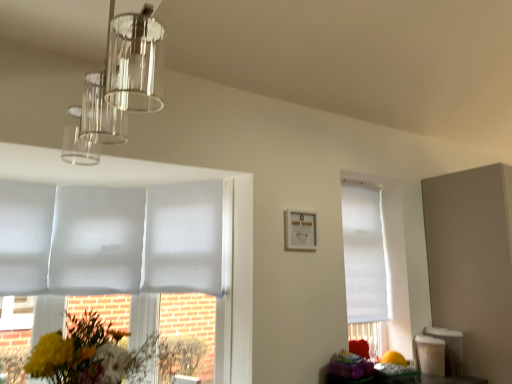
The width and height of the screenshot is (512, 384). What do you see at coordinates (25, 236) in the screenshot? I see `white matte blind at left, positioned as the 4th blind in right-to-left order` at bounding box center [25, 236].

Where is `matte white picture frame at center`? matte white picture frame at center is located at coordinates (300, 230).

Where is `white matte blind at center, which is the 3th blind in left-to-right order`? Image resolution: width=512 pixels, height=384 pixels. white matte blind at center, which is the 3th blind in left-to-right order is located at coordinates (184, 238).

Is point (155, 69) closer or farther from the camera than point (106, 214)?

Point (155, 69) appears to be closer to the viewer than point (106, 214).

Does clear glass pendant light at upper left have a greater width compared to white matte blind at left, the third blind from the right?

Correct, the width of clear glass pendant light at upper left exceeds that of white matte blind at left, the third blind from the right.

Are clear glass pendant light at upper left and white matte blind at left, the third blind from the right, located far from each other?

Actually, clear glass pendant light at upper left and white matte blind at left, the third blind from the right, are a little close together.

From a real-world perspective, which object rests below the other?

In real-world perspective, white matte blind at left, the 2th blind when ordered from left to right, is lower.

Looking at this image, does white matte blind at left, the third blind from the right, come behind fluffy bouquet at lower left?

Yes, white matte blind at left, the third blind from the right, is further from the viewer.

From the image's perspective, which is below, white matte blind at left, the 2th blind when ordered from left to right, or fluffy bouquet at lower left?

fluffy bouquet at lower left.

Looking at their sizes, would you say white matte blind at left, the 2th blind when ordered from left to right, is wider or thinner than fluffy bouquet at lower left?

In the image, white matte blind at left, the 2th blind when ordered from left to right, appears to be more narrow than fluffy bouquet at lower left.

Which object is positioned more to the left, white matte blind at right, placed as the fourth blind when sorted from left to right, or white matte blind at left, which appears as the first blind when viewed from the left?

white matte blind at left, which appears as the first blind when viewed from the left.

From a real-world perspective, is white matte blind at right, which ranks as the first blind in right-to-left order, below white matte blind at left, which appears as the first blind when viewed from the left?

Indeed, from a real-world perspective, white matte blind at right, which ranks as the first blind in right-to-left order, is positioned beneath white matte blind at left, which appears as the first blind when viewed from the left.

I want to click on the 3rd blind positioned above the white matte blind at right, which ranks as the first blind in right-to-left order (from the image's perspective), so click(25, 236).

Is white matte blind at right, placed as the fourth blind when sorted from left to right, thinner than white matte blind at left, positioned as the 4th blind in right-to-left order?

Correct, the width of white matte blind at right, placed as the fourth blind when sorted from left to right, is less than that of white matte blind at left, positioned as the 4th blind in right-to-left order.

In terms of width, does white matte blind at center, which is the 3th blind in left-to-right order, look wider or thinner when compared to clear glass pendant light at upper left?

white matte blind at center, which is the 3th blind in left-to-right order, is thinner than clear glass pendant light at upper left.

Which is more to the left, white matte blind at center, which is the 3th blind in left-to-right order, or clear glass pendant light at upper left?

white matte blind at center, which is the 3th blind in left-to-right order, is more to the left.

Could you tell me if white matte blind at center, placed as the second blind when sorted from right to left, is facing clear glass pendant light at upper left?

Yes, white matte blind at center, placed as the second blind when sorted from right to left, is oriented towards clear glass pendant light at upper left.

Considering the relative positions of white matte blind at center, which is the 3th blind in left-to-right order, and clear glass pendant light at upper left in the image provided, is white matte blind at center, which is the 3th blind in left-to-right order, behind clear glass pendant light at upper left?

Yes, white matte blind at center, which is the 3th blind in left-to-right order, is behind clear glass pendant light at upper left.

How many degrees apart are the facing directions of white matte blind at left, which appears as the first blind when viewed from the left, and white matte blind at center, placed as the second blind when sorted from right to left?

white matte blind at left, which appears as the first blind when viewed from the left, and white matte blind at center, placed as the second blind when sorted from right to left, are facing 53.6 degrees away from each other.

In terms of width, does white matte blind at left, which appears as the first blind when viewed from the left, look wider or thinner when compared to white matte blind at center, placed as the second blind when sorted from right to left?

In the image, white matte blind at left, which appears as the first blind when viewed from the left, appears to be wider than white matte blind at center, placed as the second blind when sorted from right to left.

Where is `blind that is the 2nd object above the white matte blind at left, which appears as the first blind when viewed from the left (from a real-world perspective)`? Image resolution: width=512 pixels, height=384 pixels. blind that is the 2nd object above the white matte blind at left, which appears as the first blind when viewed from the left (from a real-world perspective) is located at coordinates (184, 238).

Which of these two, fluffy bouquet at lower left or white matte blind at center, placed as the second blind when sorted from right to left, is bigger?

white matte blind at center, placed as the second blind when sorted from right to left.

Measure the distance between fluffy bouquet at lower left and white matte blind at center, placed as the second blind when sorted from right to left.

The distance of fluffy bouquet at lower left from white matte blind at center, placed as the second blind when sorted from right to left, is 4.01 feet.

At what (x,y) coordinates should I click in order to perform the action: click on floral arrangement on the right side of white matte blind at center, which is the 3th blind in left-to-right order. Please return your answer as a coordinate pair (x, y). Looking at the image, I should click on (81, 353).

Between fluffy bouquet at lower left and white matte blind at center, which is the 3th blind in left-to-right order, which one has less height?

fluffy bouquet at lower left.

Considering the sizes of clear glass pendant light at upper left and white matte blind at left, which appears as the first blind when viewed from the left, in the image, is clear glass pendant light at upper left taller or shorter than white matte blind at left, which appears as the first blind when viewed from the left,?

Considering their sizes, clear glass pendant light at upper left has less height than white matte blind at left, which appears as the first blind when viewed from the left.

From the image's perspective, which is above, clear glass pendant light at upper left or white matte blind at left, positioned as the 4th blind in right-to-left order?

clear glass pendant light at upper left.

Would you say clear glass pendant light at upper left is a long distance from white matte blind at left, positioned as the 4th blind in right-to-left order?

clear glass pendant light at upper left is far away from white matte blind at left, positioned as the 4th blind in right-to-left order.

Considering the sizes of objects clear glass pendant light at upper left and white matte blind at left, which appears as the first blind when viewed from the left, in the image provided, who is wider, clear glass pendant light at upper left or white matte blind at left, which appears as the first blind when viewed from the left,?

clear glass pendant light at upper left.

The height and width of the screenshot is (384, 512). I want to click on lamp on the right of white matte blind at left, the 2th blind when ordered from left to right, so click(x=117, y=87).

Where is `blind that is the 2nd object located above the fluffy bouquet at lower left (from the image's perspective)`? blind that is the 2nd object located above the fluffy bouquet at lower left (from the image's perspective) is located at coordinates (97, 240).

Based on their spatial positions, is white matte blind at right, placed as the fourth blind when sorted from left to right, or matte white picture frame at center closer to white matte blind at left, the 2th blind when ordered from left to right?

matte white picture frame at center lies closer to white matte blind at left, the 2th blind when ordered from left to right, than the other object.

Considering their positions, is fluffy bouquet at lower left positioned closer to white matte blind at left, the third blind from the right, than white matte blind at center, placed as the second blind when sorted from right to left?

white matte blind at center, placed as the second blind when sorted from right to left, lies closer to white matte blind at left, the third blind from the right, than the other object.

Which object lies nearer to the anchor point white matte blind at right, placed as the fourth blind when sorted from left to right, white matte blind at center, which is the 3th blind in left-to-right order, or fluffy bouquet at lower left?

white matte blind at center, which is the 3th blind in left-to-right order, is positioned closer to the anchor white matte blind at right, placed as the fourth blind when sorted from left to right.

Estimate the real-world distances between objects in this image. Which object is further from white matte blind at left, the 2th blind when ordered from left to right, clear glass pendant light at upper left or matte white picture frame at center?

Among the two, matte white picture frame at center is located further to white matte blind at left, the 2th blind when ordered from left to right.

Considering their positions, is clear glass pendant light at upper left positioned further to white matte blind at left, the third blind from the right, than white matte blind at center, placed as the second blind when sorted from right to left?

Among the two, clear glass pendant light at upper left is located further to white matte blind at left, the third blind from the right.

Based on their spatial positions, is fluffy bouquet at lower left or white matte blind at left, positioned as the 4th blind in right-to-left order, closer to matte white picture frame at center?

fluffy bouquet at lower left lies closer to matte white picture frame at center than the other object.

From the image, which object appears to be nearer to matte white picture frame at center, white matte blind at left, positioned as the 4th blind in right-to-left order, or white matte blind at left, the third blind from the right?

white matte blind at left, the third blind from the right.

Which object lies further to the anchor point white matte blind at center, which is the 3th blind in left-to-right order, white matte blind at left, positioned as the 4th blind in right-to-left order, or white matte blind at right, which ranks as the first blind in right-to-left order?

white matte blind at right, which ranks as the first blind in right-to-left order, is positioned further to the anchor white matte blind at center, which is the 3th blind in left-to-right order.

The image size is (512, 384). Identify the location of blind between clear glass pendant light at upper left and white matte blind at left, positioned as the 4th blind in right-to-left order, from front to back. (184, 238).

You are a GUI agent. You are given a task and a screenshot of the screen. Output one action in this format:
    pyautogui.click(x=<x>, y=<y>)
    Task: Click on the blind between white matte blind at left, which appears as the first blind when viewed from the left, and white matte blind at center, placed as the second blind when sorted from right to left, from left to right
    The image size is (512, 384).
    Given the screenshot: What is the action you would take?
    pyautogui.click(x=97, y=240)

Identify the location of picture frame positioned between fluffy bouquet at lower left and white matte blind at left, which appears as the first blind when viewed from the left, from near to far. (300, 230).

Locate an element on the screen. The image size is (512, 384). picture frame between clear glass pendant light at upper left and white matte blind at center, which is the 3th blind in left-to-right order, from front to back is located at coordinates (300, 230).